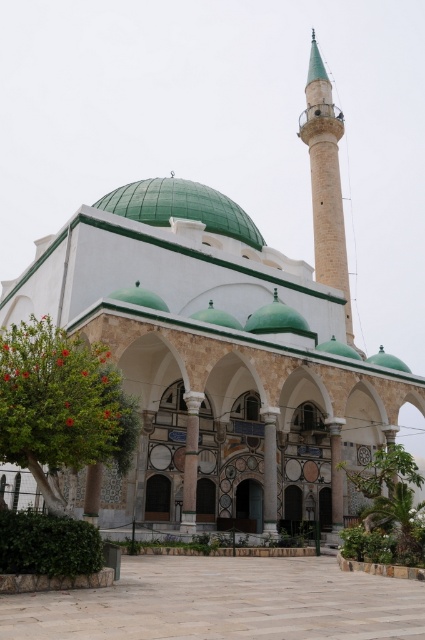
You are an architect designing a new mosque and want to ensure the minaret and arch proportions are accurate. Based on the image, does the light beige stone minaret at upper center have a greater width than the polished stone arch at center?

The light beige stone minaret at upper center might be wider than polished stone arch at center according to the description provided.

Consider the image. You are an architect designing a new mosque and want to ensure the white marble column at center and the polished stone arch at center are proportionate. Based on the existing design, which object should be made larger to maintain the current proportions?

The white marble column at center should be made larger than the polished stone arch at center to maintain the current proportions.

You are standing in front of the mosque and notice a point marked at coordinates (190,461). Based on the scene description, can you identify what this point is located on?

The point at coordinates (190,461) is located on the white marble column at center.